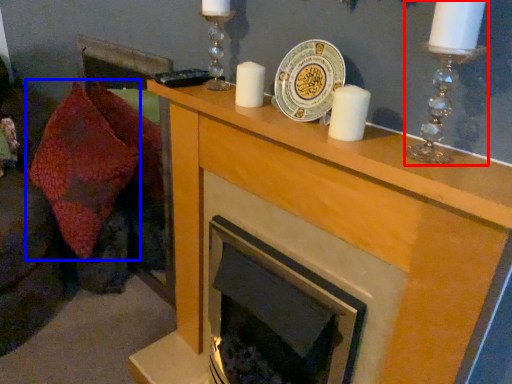
Question: Which object appears closest to the camera in this image, candle holder (highlighted by a red box) or throw pillow (highlighted by a blue box)?

Choices:
 (A) candle holder
 (B) throw pillow

Answer: (A)